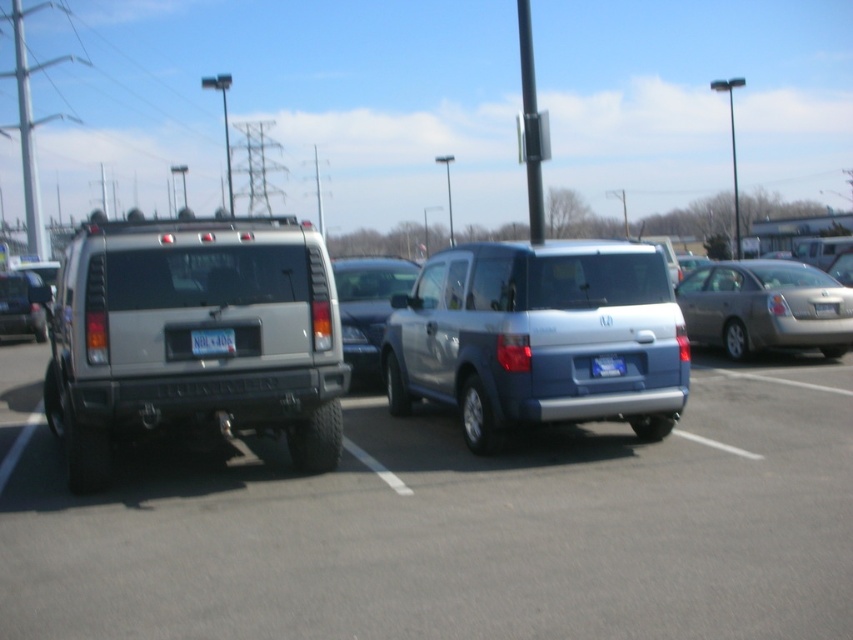
Can you confirm if white plastic license plate at rear is thinner than blue metallic license plate at rear?

Yes.

Who is more distant from viewer, (x=231, y=348) or (x=590, y=358)?

Positioned behind is point (x=590, y=358).

The width and height of the screenshot is (853, 640). Find the location of `white plastic license plate at rear`. white plastic license plate at rear is located at coordinates (212, 340).

Between satin silver minivan at center and white plastic license plate at rear, which one has less height?

white plastic license plate at rear is shorter.

The width and height of the screenshot is (853, 640). Describe the element at coordinates (538, 337) in the screenshot. I see `satin silver minivan at center` at that location.

Is point (524, 412) positioned after point (225, 342)?

Yes, point (524, 412) is behind point (225, 342).

Where is `satin silver minivan at center`? This screenshot has height=640, width=853. satin silver minivan at center is located at coordinates (538, 337).

Can you confirm if satin silver suv at center is wider than satin silver minivan at center?

Indeed, satin silver suv at center has a greater width compared to satin silver minivan at center.

Measure the distance from satin silver suv at center to satin silver minivan at center.

satin silver suv at center is 1.32 meters away from satin silver minivan at center.

Locate an element on the screen. This screenshot has height=640, width=853. satin silver suv at center is located at coordinates (451, 525).